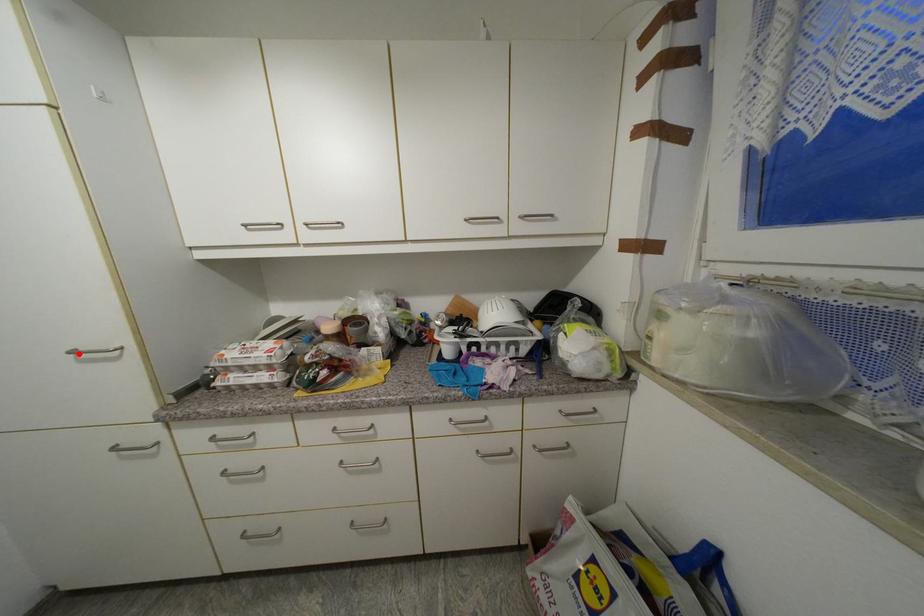
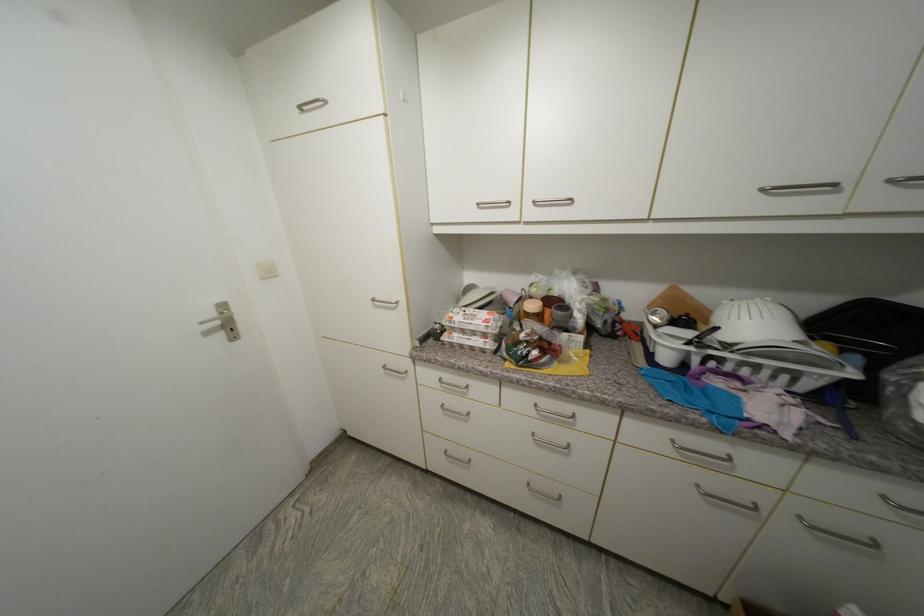
In the second image, find the point that corresponds to the highlighted location in the first image.

(379, 301)